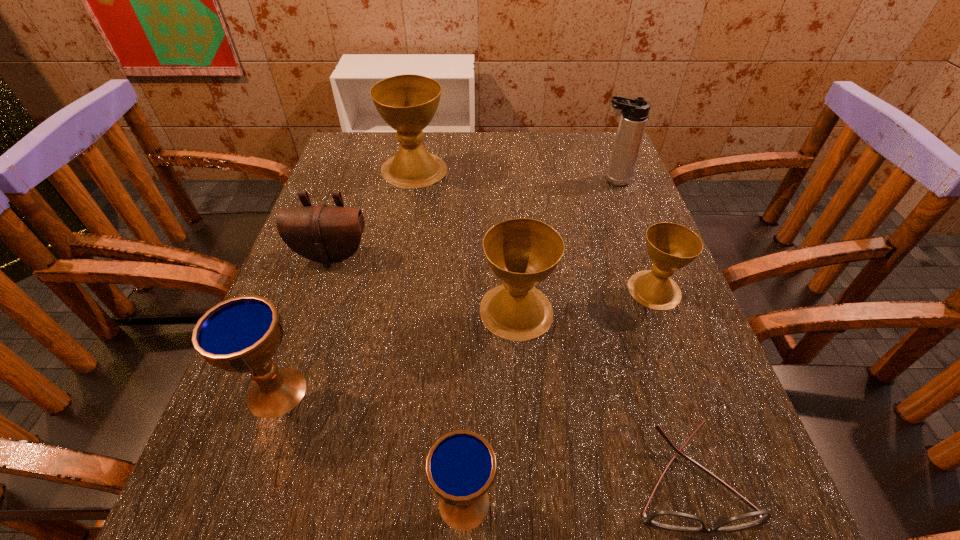
What are the coordinates of `the smaller blue chalice` in the screenshot? It's located at 461,466.

The width and height of the screenshot is (960, 540). I want to click on the right blue chalice, so click(x=461, y=466).

Identify the location of the shortest object. This screenshot has height=540, width=960. (672, 520).

What are the coordinates of `free point located on the left of the tallest chalice` in the screenshot? It's located at (363, 170).

Identify the location of free point located on the handle side of the thermos bottle. (575, 180).

Locate an element on the screen. vacant space located 0.290m on the handle side of the thermos bottle is located at coordinates (484, 180).

At what (x,y) coordinates should I click in order to perform the action: click on vacant space situated 0.360m on the handle side of the thermos bottle. Please return your answer as a coordinate pair (x, y). Looking at the image, I should click on (457, 180).

At what (x,y) coordinates should I click in order to perform the action: click on blank space located on the left of the second biggest brown chalice. Please return your answer as a coordinate pair (x, y). Looking at the image, I should click on (428, 311).

The image size is (960, 540). Identify the location of free point located on the right of the left blue chalice. (552, 392).

This screenshot has width=960, height=540. Identify the location of vacant position located 0.180m with the flap open on the pouch. (303, 339).